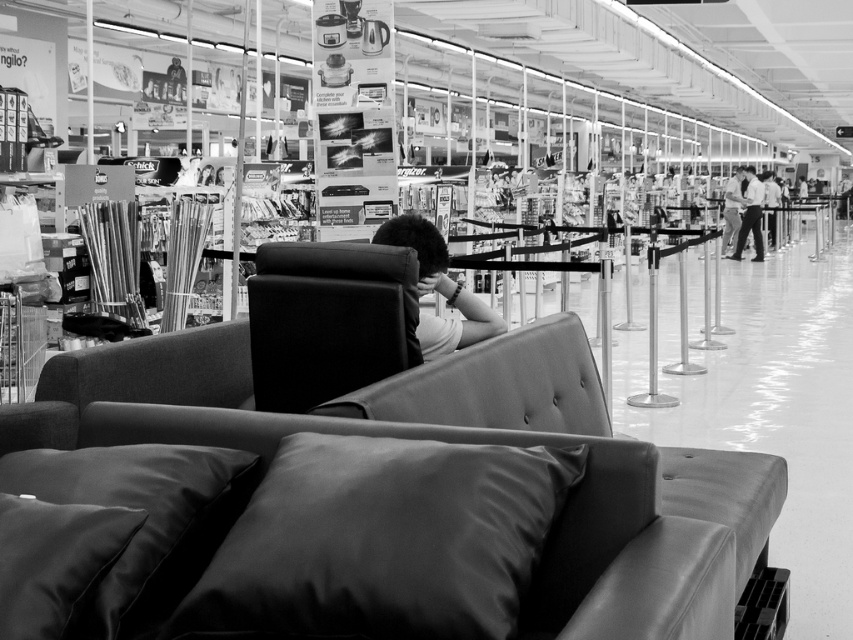
Question: From the image, what is the correct spatial relationship of leather-like armchair at center in relation to satin black pillow at lower left?

Choices:
 (A) below
 (B) above

Answer: (B)

Question: Observing the image, what is the correct spatial positioning of satin black couch at center in reference to leather-like armchair at center?

Choices:
 (A) right
 (B) left

Answer: (A)

Question: Among these points, which one is farthest from the camera?

Choices:
 (A) (173, 515)
 (B) (78, 534)
 (C) (289, 618)
 (D) (376, 544)

Answer: (A)

Question: Which object is the closest to the dark brown leather chair at center?

Choices:
 (A) leather-like armchair at center
 (B) light brown leather pants at right

Answer: (A)

Question: Does leather-like armchair at center appear under dark brown leather chair at center?

Choices:
 (A) yes
 (B) no

Answer: (A)

Question: Which point appears closest to the camera in this image?

Choices:
 (A) (405, 440)
 (B) (189, 490)
 (C) (166, 566)
 (D) (461, 300)

Answer: (C)